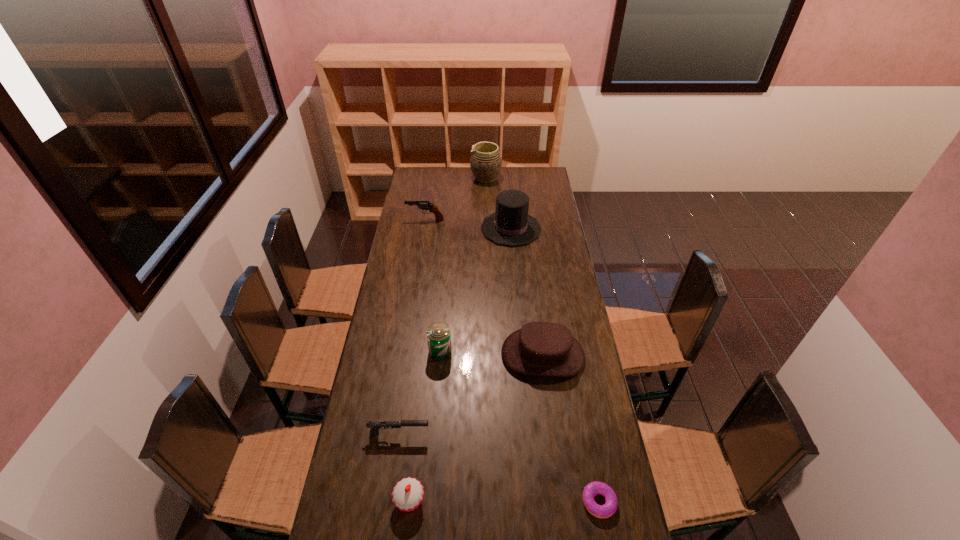
You are a GUI agent. You are given a task and a screenshot of the screen. Output one action in this format:
    pyautogui.click(x=<x>, y=<y>)
    Task: Click on the vacant point that satisfies the following two spatial constraints: 1. at the muzzle end of the seventh tallest object; 2. on the left side of the sixth tallest object
    This screenshot has height=540, width=960.
    Given the screenshot: What is the action you would take?
    pyautogui.click(x=389, y=501)

The image size is (960, 540). In order to click on free spot that satisfies the following two spatial constraints: 1. on the back side of the nearer hat; 2. on the right side of the cupcake in this screenshot , I will do `click(426, 355)`.

At what (x,y) coordinates should I click in order to perform the action: click on vacant area that satisfies the following two spatial constraints: 1. on the front side of the doughnut; 2. on the right side of the farthest object. Please return your answer as a coordinate pair (x, y). Looking at the image, I should click on pyautogui.click(x=492, y=502).

The width and height of the screenshot is (960, 540). Identify the location of free point that satisfies the following two spatial constraints: 1. on the back side of the cupcake; 2. on the right side of the farthest object. (445, 178).

In order to click on blank area in the image that satisfies the following two spatial constraints: 1. on the front side of the farthest object; 2. at the muzzle end of the shorter gun in this screenshot , I will do `click(491, 433)`.